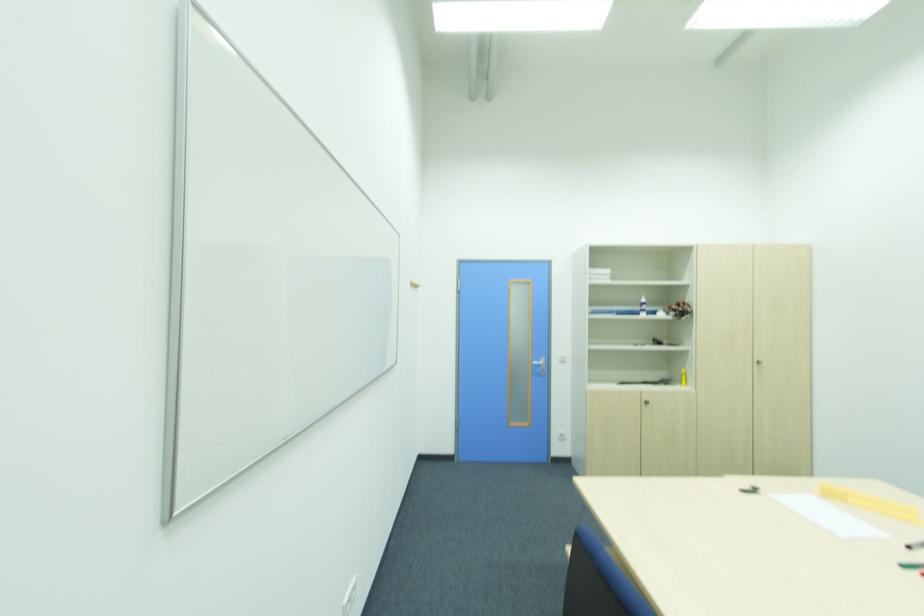
Locate an element on the screen. This screenshot has width=924, height=616. black marker is located at coordinates (749, 488).